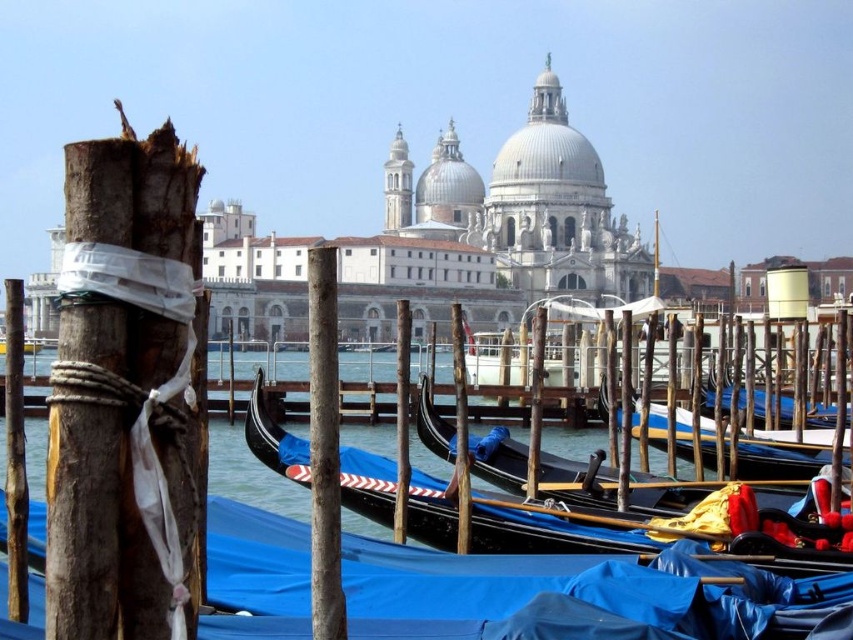
Is black polished gondola at center wider than wooden gondola at center?

Yes, black polished gondola at center is wider than wooden gondola at center.

The width and height of the screenshot is (853, 640). Describe the element at coordinates (572, 596) in the screenshot. I see `black polished gondola at center` at that location.

Is point (416, 563) positioned before point (749, 554)?

Yes, point (416, 563) is in front of point (749, 554).

You are a GUI agent. You are given a task and a screenshot of the screen. Output one action in this format:
    pyautogui.click(x=<x>, y=<y>)
    Task: Click on the black polished gondola at center
    This screenshot has width=853, height=640.
    Given the screenshot: What is the action you would take?
    pyautogui.click(x=572, y=596)